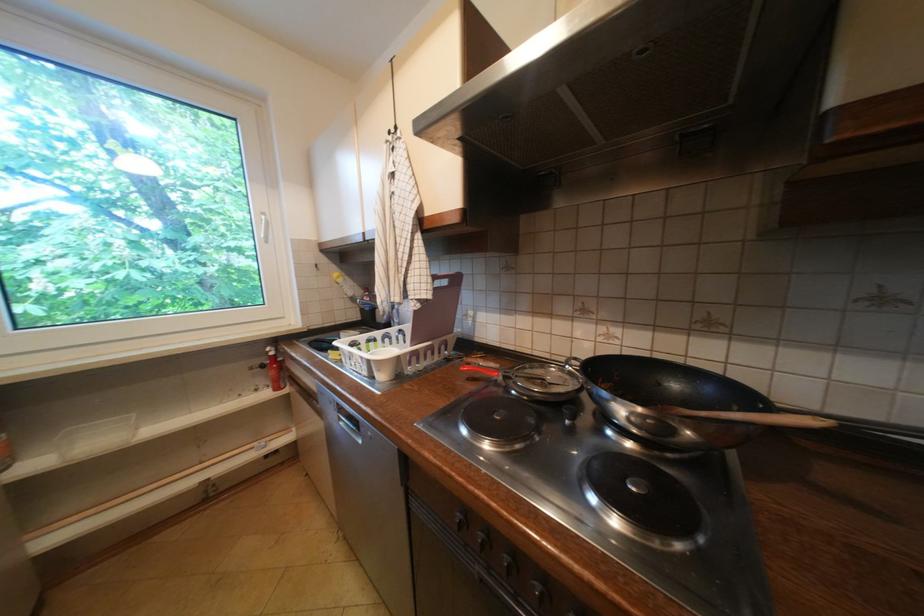
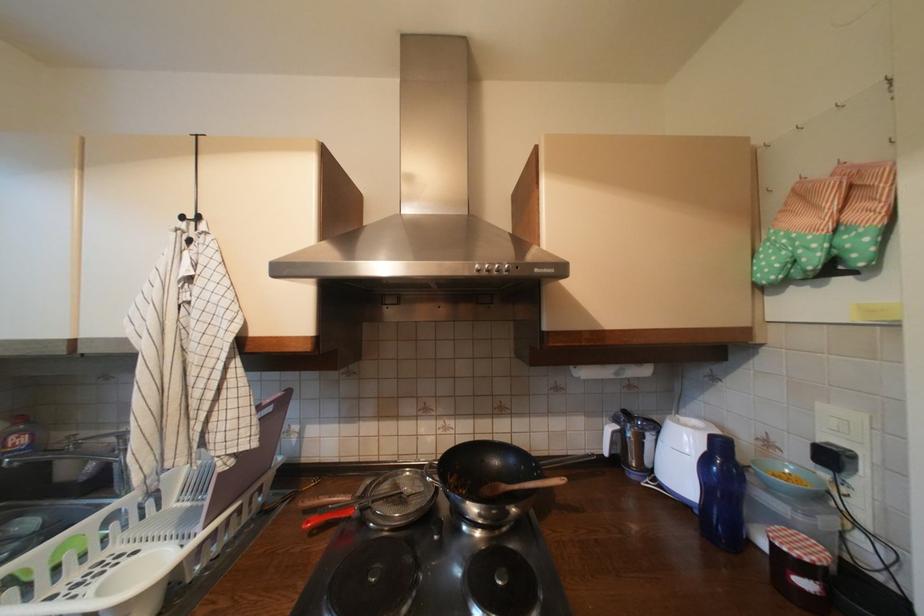
Where in the second image is the point corresponding to (472,369) from the first image?

(317, 524)